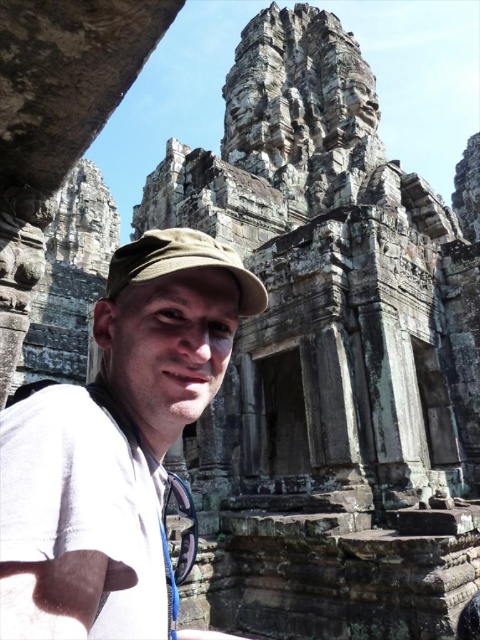
Question: Which object is farther from the camera taking this photo?

Choices:
 (A) white fabric shirt at center
 (B) green fabric cap at center

Answer: (B)

Question: Is white fabric shirt at center to the left of green fabric cap at center from the viewer's perspective?

Choices:
 (A) yes
 (B) no

Answer: (B)

Question: Which point is farther from the camera taking this photo?

Choices:
 (A) (216, 257)
 (B) (212, 336)

Answer: (B)

Question: Is white fabric shirt at center bigger than green fabric cap at center?

Choices:
 (A) yes
 (B) no

Answer: (A)

Question: In this image, where is white fabric shirt at center located relative to green fabric cap at center?

Choices:
 (A) above
 (B) below

Answer: (B)